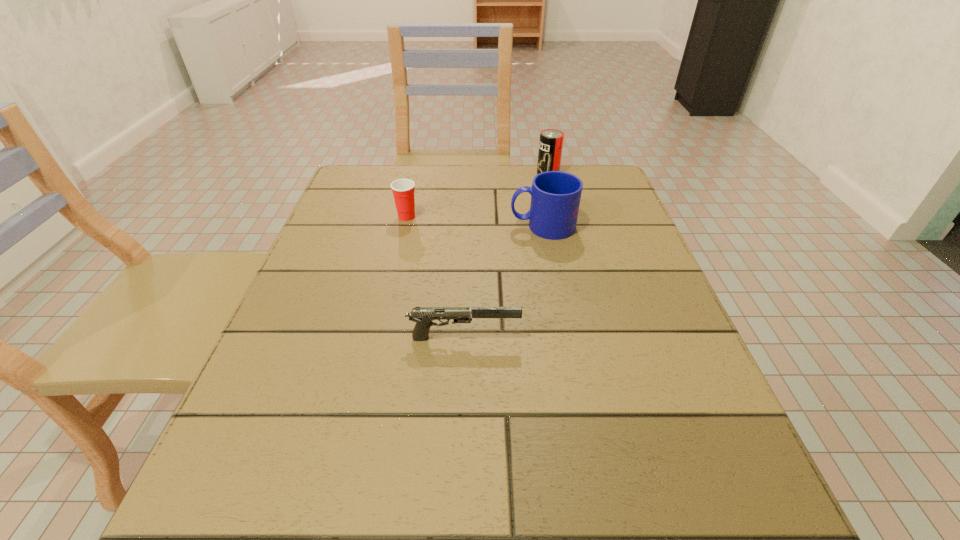
Where is `free region at the left edge of the desktop`? Image resolution: width=960 pixels, height=540 pixels. free region at the left edge of the desktop is located at coordinates (379, 216).

The image size is (960, 540). Identify the location of vacant area at the right edge. (612, 232).

The width and height of the screenshot is (960, 540). Find the location of `free space at the far left corner`. free space at the far left corner is located at coordinates (377, 191).

The image size is (960, 540). In the image, there is a desktop. What are the coordinates of `free region at the near left corner` in the screenshot? It's located at (316, 531).

Where is `vacant region at the far right corner of the desktop`? The height and width of the screenshot is (540, 960). vacant region at the far right corner of the desktop is located at coordinates (589, 210).

Identify the location of free region at the near right corner of the desktop. The width and height of the screenshot is (960, 540). (736, 512).

Locate an element on the screen. The width and height of the screenshot is (960, 540). vacant space in between the can and the Dixie cup is located at coordinates (477, 195).

Locate an element on the screen. free point between the leftmost object and the mug is located at coordinates (474, 221).

At what (x,y) coordinates should I click in order to perform the action: click on free space between the shortest object and the Dixie cup. Please return your answer as a coordinate pair (x, y). Looking at the image, I should click on (435, 277).

Locate an element on the screen. vacant area that lies between the Dixie cup and the mug is located at coordinates click(x=474, y=221).